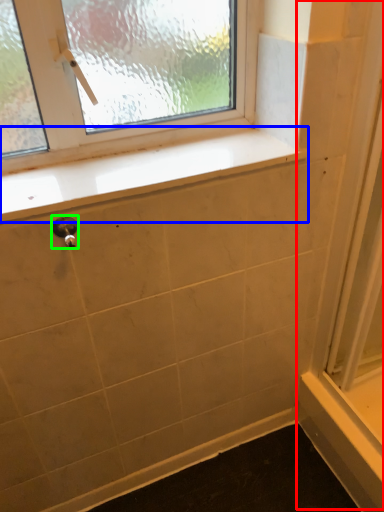
Question: Estimate the real-world distances between objects in this image. Which object is closer to screen door (highlighted by a red box), window sill (highlighted by a blue box) or door handle (highlighted by a green box)?

Choices:
 (A) window sill
 (B) door handle

Answer: (A)